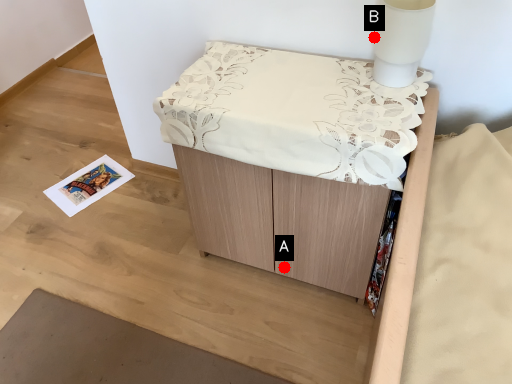
Question: Two points are circled on the image, labeled by A and B beside each circle. Which point is closer to the camera?

Choices:
 (A) A is closer
 (B) B is closer

Answer: (B)